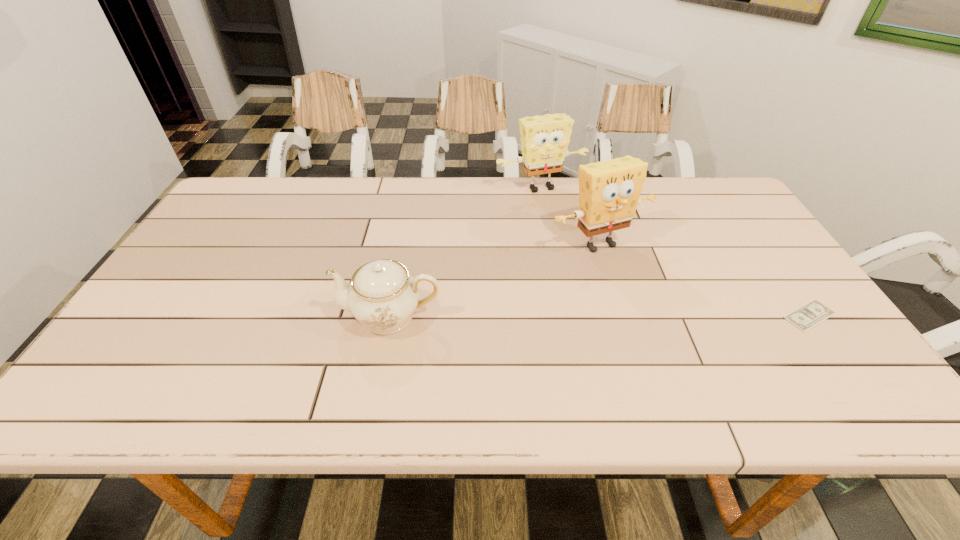
Identify the location of the third tallest object. (383, 295).

The width and height of the screenshot is (960, 540). Identify the location of the leftmost object. (383, 295).

You are a GUI agent. You are given a task and a screenshot of the screen. Output one action in this format:
    pyautogui.click(x=<x>, y=<y>)
    Task: Click on the money
    
    Given the screenshot: What is the action you would take?
    pyautogui.click(x=807, y=316)

The height and width of the screenshot is (540, 960). Find the location of `the rightmost object`. the rightmost object is located at coordinates (807, 316).

Find the location of `the farthest object`. the farthest object is located at coordinates (544, 139).

This screenshot has width=960, height=540. What are the coordinates of `the second farthest object` in the screenshot? It's located at (609, 192).

In order to click on free space located at the spout of the leftmost object in this screenshot , I will do `click(218, 316)`.

The height and width of the screenshot is (540, 960). What are the coordinates of `vacant region located at the spout of the leftmost object` in the screenshot? It's located at (177, 316).

This screenshot has height=540, width=960. In order to click on vacant space positioned at the spout of the leftmost object in this screenshot , I will do `click(268, 316)`.

Locate an element on the screen. vacant space located 0.250m on the left of the rightmost object is located at coordinates pos(677,315).